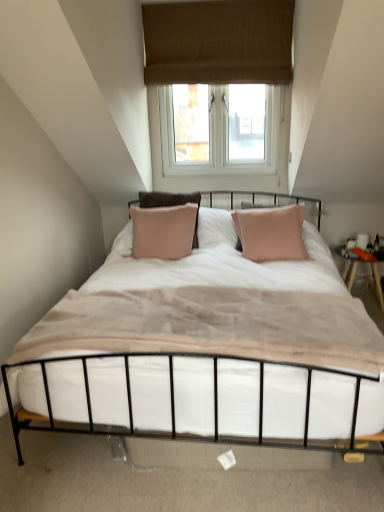
Question: Is metallic white bed at center smaller than wooden nightstand at right?

Choices:
 (A) yes
 (B) no

Answer: (B)

Question: Could you tell me if metallic white bed at center is turned towards wooden nightstand at right?

Choices:
 (A) yes
 (B) no

Answer: (B)

Question: Is metallic white bed at center touching wooden nightstand at right?

Choices:
 (A) no
 (B) yes

Answer: (A)

Question: Is metallic white bed at center facing away from wooden nightstand at right?

Choices:
 (A) yes
 (B) no

Answer: (B)

Question: Is metallic white bed at center at the left side of wooden nightstand at right?

Choices:
 (A) no
 (B) yes

Answer: (B)

Question: From the image's perspective, is metallic white bed at center beneath wooden nightstand at right?

Choices:
 (A) no
 (B) yes

Answer: (B)

Question: Is metallic white bed at center located outside brown fabric window at upper center?

Choices:
 (A) yes
 (B) no

Answer: (A)

Question: Is metallic white bed at center in front of brown fabric window at upper center?

Choices:
 (A) no
 (B) yes

Answer: (B)

Question: From the image's perspective, is metallic white bed at center under brown fabric window at upper center?

Choices:
 (A) yes
 (B) no

Answer: (A)

Question: From a real-world perspective, is metallic white bed at center below brown fabric window at upper center?

Choices:
 (A) no
 (B) yes

Answer: (B)

Question: Considering the relative sizes of metallic white bed at center and brown fabric window at upper center in the image provided, is metallic white bed at center bigger than brown fabric window at upper center?

Choices:
 (A) no
 (B) yes

Answer: (B)

Question: Is metallic white bed at center behind brown fabric window at upper center?

Choices:
 (A) no
 (B) yes

Answer: (A)

Question: Is brown fabric window at upper center positioned in front of metallic white bed at center?

Choices:
 (A) no
 (B) yes

Answer: (A)